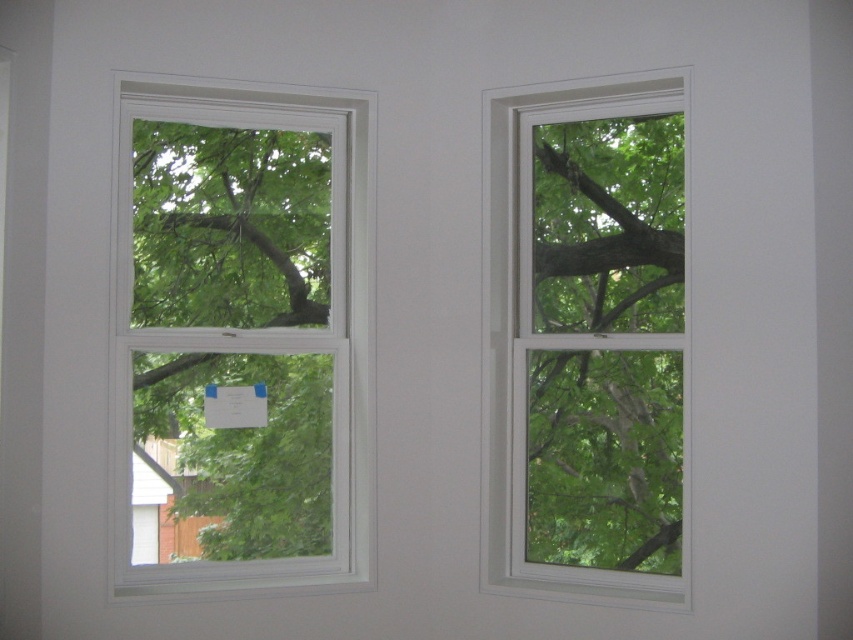
You are standing in a room with two windows side by side. You notice a point marked at coordinates (241, 337). Which window is this point located on?

The point at (241, 337) is located on the white plastic window at left.

You are standing in a room with two white plastic windows. You need to hang a plant hanger on the window that is on the right side. Which window should you choose between the white plastic window at left and the white plastic window at center?

You should choose the white plastic window at center because it is positioned to the right of the white plastic window at left.